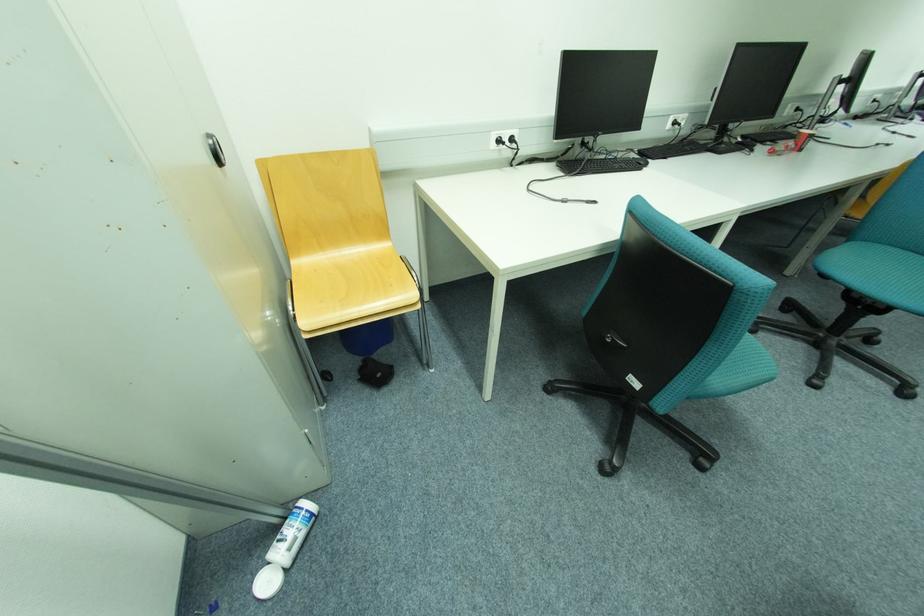
Find the location of a particular element. white bottle cap is located at coordinates (268, 581).